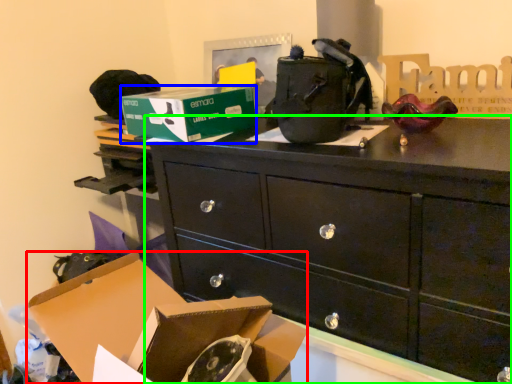
Question: Considering the real-world distances, which object is closest to box (highlighted by a red box)? box (highlighted by a blue box) or chest of drawers (highlighted by a green box).

Choices:
 (A) box
 (B) chest of drawers

Answer: (B)